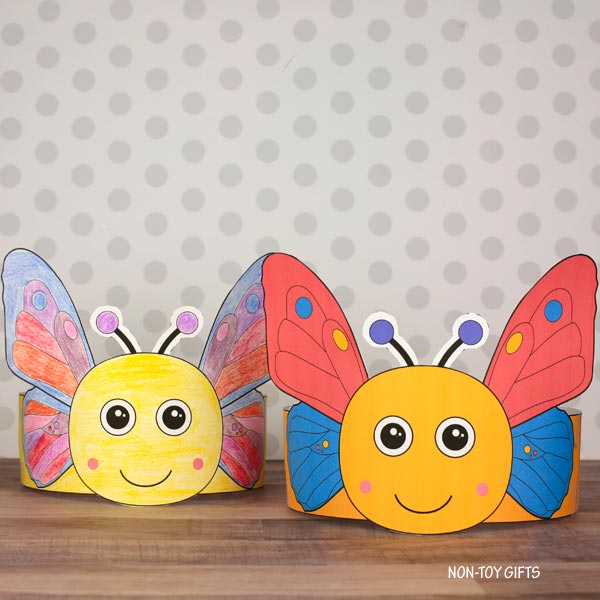
Locate an element on the screen. table is located at coordinates coord(20,518), coord(142,534), coord(140,573), coord(266,509), coord(281,568), coord(395,552), coord(564,544).